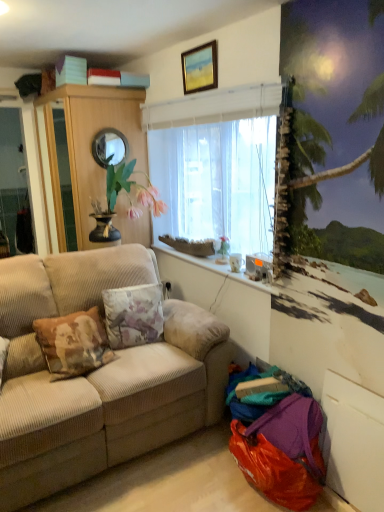
Question: In the image, is wooden picture frame at upper center positioned in front of or behind beige corduroy couch at left?

Choices:
 (A) behind
 (B) front

Answer: (A)

Question: From a real-world perspective, relative to beige corduroy couch at left, is wooden picture frame at upper center vertically above or below?

Choices:
 (A) below
 (B) above

Answer: (B)

Question: Estimate the real-world distances between objects in this image. Which object is closer to the floral fabric pillow at center?

Choices:
 (A) translucent fabric at center
 (B) beige corduroy couch at left
 (C) white marble window sill at center
 (D) wooden picture frame at upper center
 (E) white glossy coffee cup at lower right

Answer: (B)

Question: Which object is the closest to the translucent fabric at center?

Choices:
 (A) beige corduroy couch at left
 (B) shiny silver mirror at upper center
 (C) white marble window sill at center
 (D) floral fabric pillow at center
 (E) wooden picture frame at upper center

Answer: (C)